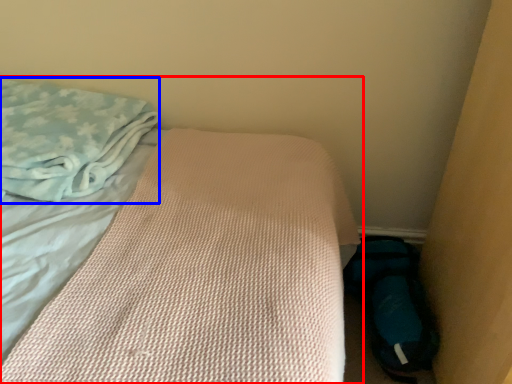
Question: Which of the following is the closest to the observer, bed (highlighted by a red box) or cloth (highlighted by a blue box)?

Choices:
 (A) bed
 (B) cloth

Answer: (A)